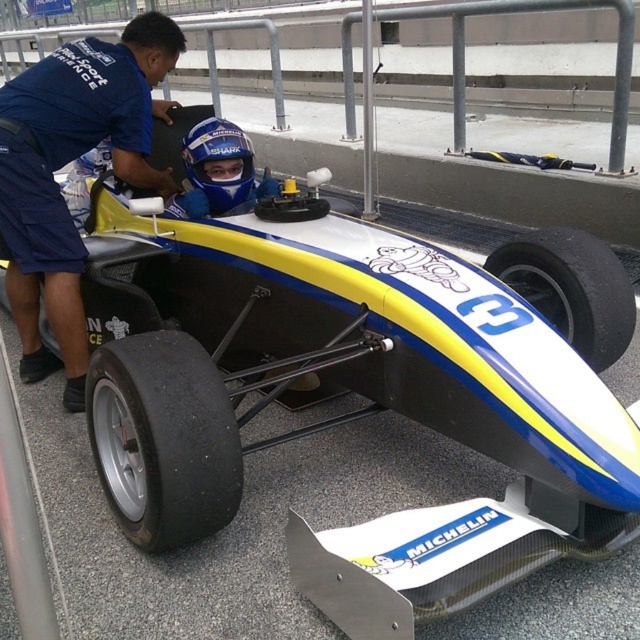
Looking at this image, who is shorter, blue fabric shirt at left or blue matte helmet at center?

blue matte helmet at center is shorter.

Can you confirm if blue fabric shirt at left is taller than blue matte helmet at center?

Indeed, blue fabric shirt at left has a greater height compared to blue matte helmet at center.

The height and width of the screenshot is (640, 640). Find the location of `blue fabric shirt at left`. blue fabric shirt at left is located at coordinates (x=65, y=164).

The image size is (640, 640). I want to click on blue fabric shirt at left, so click(x=65, y=164).

Does blue fabric shirt at left appear on the left side of black rubber tire at lower center?

Yes, blue fabric shirt at left is to the left of black rubber tire at lower center.

Does blue fabric shirt at left have a lesser height compared to black rubber tire at lower center?

No.

In order to click on blue fabric shirt at left in this screenshot , I will do pyautogui.click(x=65, y=164).

You are a GUI agent. You are given a task and a screenshot of the screen. Output one action in this format:
    pyautogui.click(x=<x>, y=<y>)
    Task: Click on the blue fabric shirt at left
    
    Given the screenshot: What is the action you would take?
    pyautogui.click(x=65, y=164)

Between blue fabric shirt at left and black rubber tire at lower left, which one is positioned higher?

blue fabric shirt at left is above.

Between point (65, 145) and point (179, 544), which one is positioned behind?

Point (65, 145)

Describe the element at coordinates (65, 164) in the screenshot. I see `blue fabric shirt at left` at that location.

Where is `blue fabric shirt at left`? The height and width of the screenshot is (640, 640). blue fabric shirt at left is located at coordinates (65, 164).